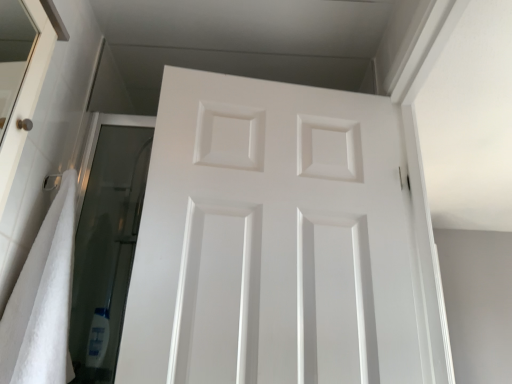
I want to click on white soft towel at left, so click(42, 299).

The width and height of the screenshot is (512, 384). Describe the element at coordinates (42, 299) in the screenshot. I see `white soft towel at left` at that location.

Identify the location of white matte door at center. (281, 241).

In order to face white matte door at center, should I rotate leftwards or rightwards?

You should look right and rotate roughly 3.129 degrees.

Image resolution: width=512 pixels, height=384 pixels. What do you see at coordinates (281, 241) in the screenshot?
I see `white matte door at center` at bounding box center [281, 241].

Locate an element on the screen. The image size is (512, 384). white soft towel at left is located at coordinates (42, 299).

Considering the relative positions of white matte door at center and white soft towel at left in the image provided, is white matte door at center to the right of white soft towel at left from the viewer's perspective?

Yes.

Which object is more forward, white matte door at center or white soft towel at left?

Positioned in front is white soft towel at left.

Considering the positions of points (159, 119) and (57, 264), is point (159, 119) farther from camera compared to point (57, 264)?

That is True.

From the image's perspective, is white matte door at center under white soft towel at left?

No.

From a real-world perspective, between white matte door at center and white soft towel at left, who is vertically higher?

white matte door at center.

Considering the sizes of objects white matte door at center and white soft towel at left in the image provided, who is wider, white matte door at center or white soft towel at left?

With larger width is white soft towel at left.

Can you confirm if white matte door at center is taller than white soft towel at left?

Correct, white matte door at center is much taller as white soft towel at left.

Can you confirm if white matte door at center is smaller than white soft towel at left?

No.

From the picture: Is white matte door at center positioned beyond the bounds of white soft towel at left?

Yes.

Is white matte door at center far away from white soft towel at left?

No, white matte door at center is not far from white soft towel at left.

Is white matte door at center looking in the opposite direction of white soft towel at left?

No, white soft towel at left is not at the back of white matte door at center.

How many degrees apart are the facing directions of white matte door at center and white soft towel at left?

86.3 degrees separate the facing orientations of white matte door at center and white soft towel at left.

How far apart are white matte door at center and white soft towel at left?

They are 18.20 inches apart.

This screenshot has width=512, height=384. In the image, there is a white matte door at center. What are the coordinates of `bath towel below it (from the image's perspective)` in the screenshot? It's located at [x=42, y=299].

Considering the relative positions of white soft towel at left and white matte door at center in the image provided, is white soft towel at left to the left or to the right of white matte door at center?

white soft towel at left is positioned on white matte door at center's left side.

Considering their positions, is white soft towel at left located in front of or behind white matte door at center?

In the image, white soft towel at left appears in front of white matte door at center.

Which is behind, point (2, 366) or point (170, 240)?

The point (170, 240) is farther.

From the image's perspective, is white soft towel at left positioned above or below white matte door at center?

From the image's perspective, white soft towel at left appears below white matte door at center.

From the picture: From a real-world perspective, relative to white matte door at center, is white soft towel at left vertically above or below?

In terms of real-world spatial position, white soft towel at left is below white matte door at center.

Can you confirm if white soft towel at left is wider than white matte door at center?

Yes.

From their relative heights in the image, would you say white soft towel at left is taller or shorter than white matte door at center?

In the image, white soft towel at left appears to be shorter than white matte door at center.

From the picture: In terms of size, does white soft towel at left appear bigger or smaller than white matte door at center?

white soft towel at left is smaller than white matte door at center.

Is white soft towel at left inside or outside of white matte door at center?

white soft towel at left is not enclosed by white matte door at center.

In the scene shown: Is white soft towel at left far from white matte door at center?

That's not correct — white soft towel at left is a little close to white matte door at center.

Is white soft towel at left aimed at white matte door at center?

Yes.

I want to click on door located above the white soft towel at left (from a real-world perspective), so click(281, 241).

This screenshot has width=512, height=384. In order to click on bath towel on the left of white matte door at center in this screenshot , I will do `click(42, 299)`.

In the image, there is a white soft towel at left. Where is `door above it (from the image's perspective)`? Image resolution: width=512 pixels, height=384 pixels. door above it (from the image's perspective) is located at coordinates (281, 241).